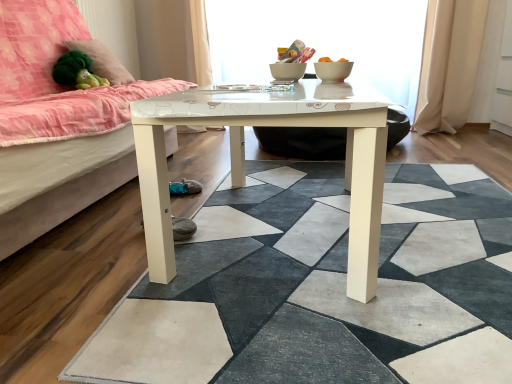
Question: Considering the positions of green plush toy at upper left and green plush at upper left in the image, is green plush toy at upper left bigger or smaller than green plush at upper left?

Choices:
 (A) big
 (B) small

Answer: (B)

Question: Does point (91, 74) appear closer or farther from the camera than point (73, 44)?

Choices:
 (A) farther
 (B) closer

Answer: (B)

Question: Which of these objects is positioned farthest from the beige fabric curtain at right?

Choices:
 (A) white glossy table at center
 (B) green plush toy at upper left
 (C) white glossy table at center
 (D) green plush at upper left
 (E) white glossy table at center

Answer: (B)

Question: Estimate the real-world distances between objects in this image. Which object is farther from the white glossy table at center?

Choices:
 (A) green plush at upper left
 (B) white glossy bowl at upper center
 (C) beige fabric curtain at right
 (D) white glossy table at center
 (E) matte pink fabric at left

Answer: (C)